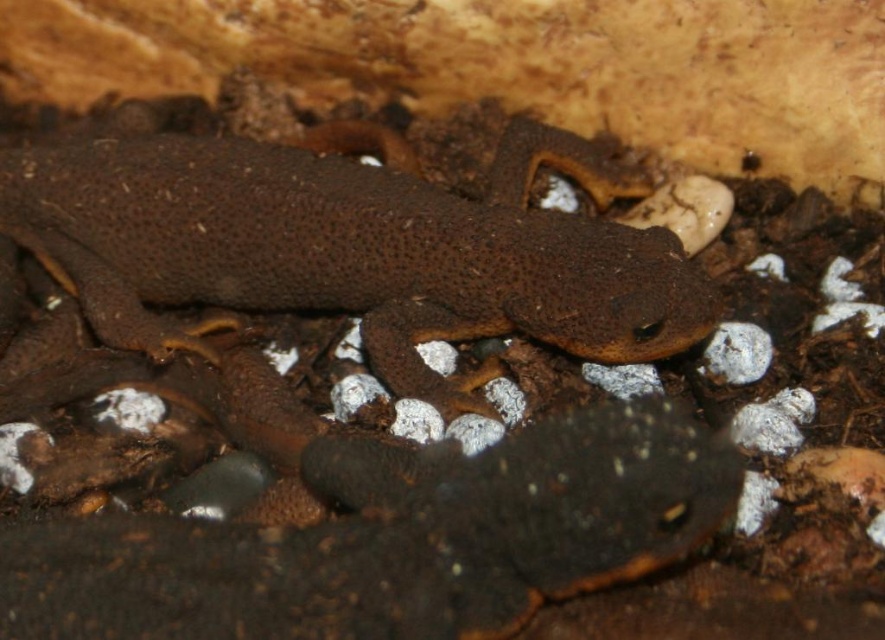
Question: Is brown rough skin lizard at center thinner than white matte stone at lower right?

Choices:
 (A) no
 (B) yes

Answer: (A)

Question: Is smooth brown lizard at center positioned behind white matte stone at lower right?

Choices:
 (A) no
 (B) yes

Answer: (A)

Question: Is brown rough skin lizard at center smaller than white matte stone at lower right?

Choices:
 (A) yes
 (B) no

Answer: (B)

Question: Which point appears farthest from the camera in this image?

Choices:
 (A) (279, 634)
 (B) (737, 339)
 (C) (419, 285)

Answer: (C)

Question: Which of the following is the closest to the observer?

Choices:
 (A) (312, 180)
 (B) (714, 369)
 (C) (179, 627)

Answer: (C)

Question: Which object appears farthest from the camera in this image?

Choices:
 (A) brown rough skin lizard at center
 (B) smooth brown lizard at center

Answer: (A)